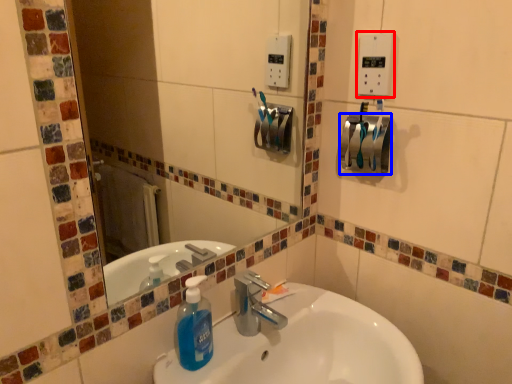
Question: Which object is further to the camera taking this photo, light switch (highlighted by a red box) or towel bar (highlighted by a blue box)?

Choices:
 (A) light switch
 (B) towel bar

Answer: (B)